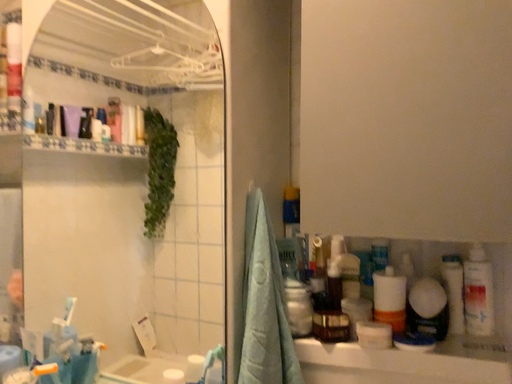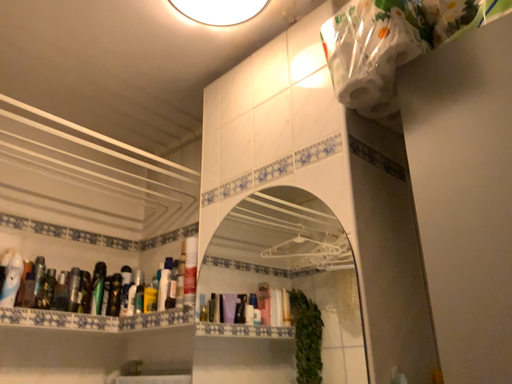
Question: How did the camera likely rotate when shooting the video?

Choices:
 (A) rotated right
 (B) rotated left

Answer: (B)